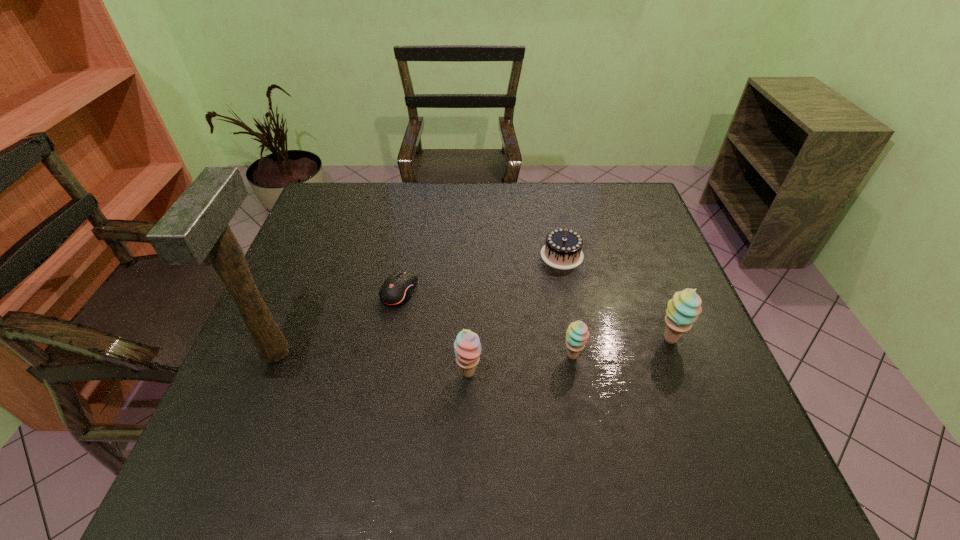
You are a GUI agent. You are given a task and a screenshot of the screen. Output one action in this format:
    pyautogui.click(x=<x>, y=<y>)
    Task: Click on the leftmost sherbert
    The image size is (960, 540).
    Given the screenshot: What is the action you would take?
    pyautogui.click(x=467, y=345)

Image resolution: width=960 pixels, height=540 pixels. Find the location of `the fourth shortest object`. the fourth shortest object is located at coordinates (467, 345).

At what (x,y) coordinates should I click in order to perform the action: click on the shortest sherbert. Please return your answer as a coordinate pair (x, y). Image resolution: width=960 pixels, height=540 pixels. Looking at the image, I should click on (577, 333).

The height and width of the screenshot is (540, 960). I want to click on the third shortest object, so click(x=577, y=333).

Identify the location of the rightmost object. This screenshot has height=540, width=960. (682, 311).

Image resolution: width=960 pixels, height=540 pixels. Identify the location of the shortest object. (397, 289).

Where is `the fifth nearest object`? The width and height of the screenshot is (960, 540). the fifth nearest object is located at coordinates (397, 289).

In order to click on the fifth tallest object in this screenshot , I will do `click(563, 248)`.

This screenshot has width=960, height=540. Find the location of `the farthest object`. the farthest object is located at coordinates (563, 248).

Where is `the tallest object`? the tallest object is located at coordinates click(196, 225).